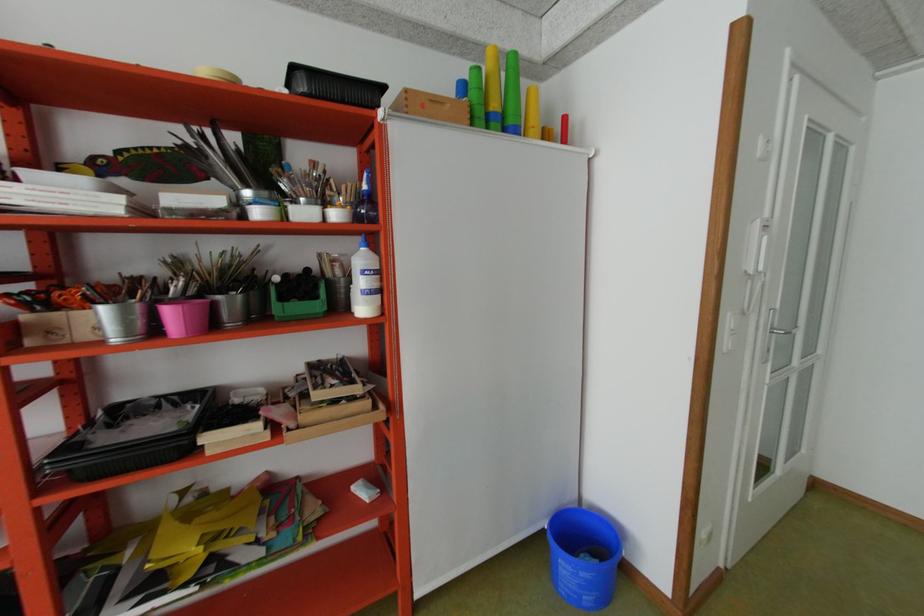
What do you see at coordinates (361, 185) in the screenshot? The height and width of the screenshot is (616, 924). I see `the spray bottle trigger` at bounding box center [361, 185].